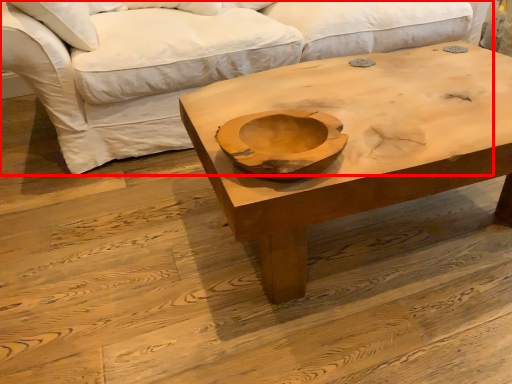
Question: From the image's perspective, where is studio couch (annotated by the red box) located in relation to coffee table in the image?

Choices:
 (A) above
 (B) below

Answer: (A)